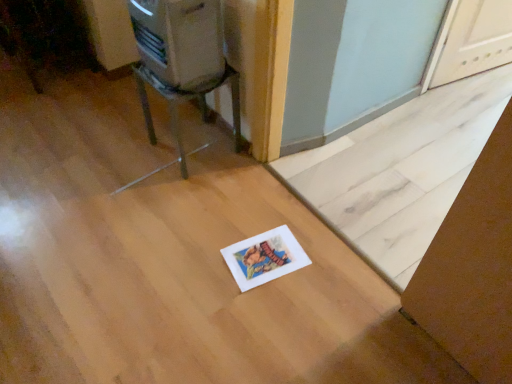
This screenshot has width=512, height=384. I want to click on free space in front of metallic silver chair at upper left, so click(x=187, y=192).